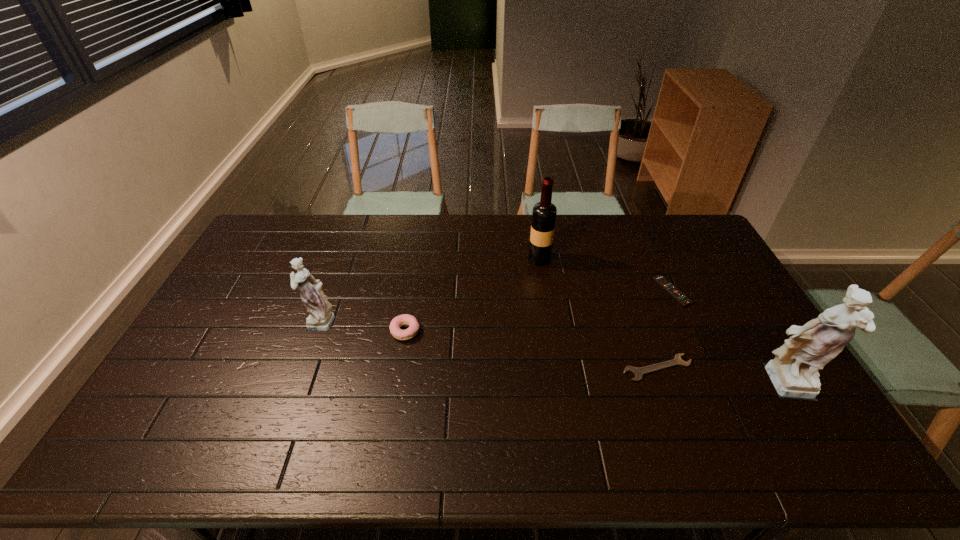
I want to click on free spot between the third shortest object and the left figurine, so click(x=362, y=326).

At what (x,y) coordinates should I click in order to perform the action: click on free space between the nearer figurine and the second farthest object. Please return your answer as a coordinate pair (x, y). The image size is (960, 540). Looking at the image, I should click on (729, 340).

This screenshot has width=960, height=540. I want to click on empty space between the second farthest object and the right figurine, so click(x=729, y=340).

Locate an element on the screen. This screenshot has width=960, height=540. blank region between the remote control and the fourth tallest object is located at coordinates (539, 312).

Locate which object is the fourth closest to the fifth shortest object. Please provide its 2D coordinates. Your answer should be formatted as a tuple, i.e. [(x, y)], where the tuple contains the x and y coordinates of a point satisfying the conditions above.

[(793, 372)]

Image resolution: width=960 pixels, height=540 pixels. Identify the location of the third closest object relative to the shorter figurine. (638, 372).

Identify the location of free location that satisfies the following two spatial constraints: 1. on the back side of the wrench; 2. on the front-facing side of the farther figurine. (640, 321).

This screenshot has width=960, height=540. I want to click on vacant position in the image that satisfies the following two spatial constraints: 1. on the front side of the second tallest object; 2. on the left side of the remote control, so (544, 291).

At what (x,y) coordinates should I click in order to perform the action: click on vacant space that satisfies the following two spatial constraints: 1. on the front side of the wine bottle; 2. on the front-facing side of the shorter figurine. Please return your answer as a coordinate pair (x, y). The height and width of the screenshot is (540, 960). Looking at the image, I should click on (549, 321).

Find the location of a particular element. This screenshot has width=960, height=540. free space that satisfies the following two spatial constraints: 1. on the front-facing side of the left figurine; 2. on the right side of the doughnut is located at coordinates (315, 332).